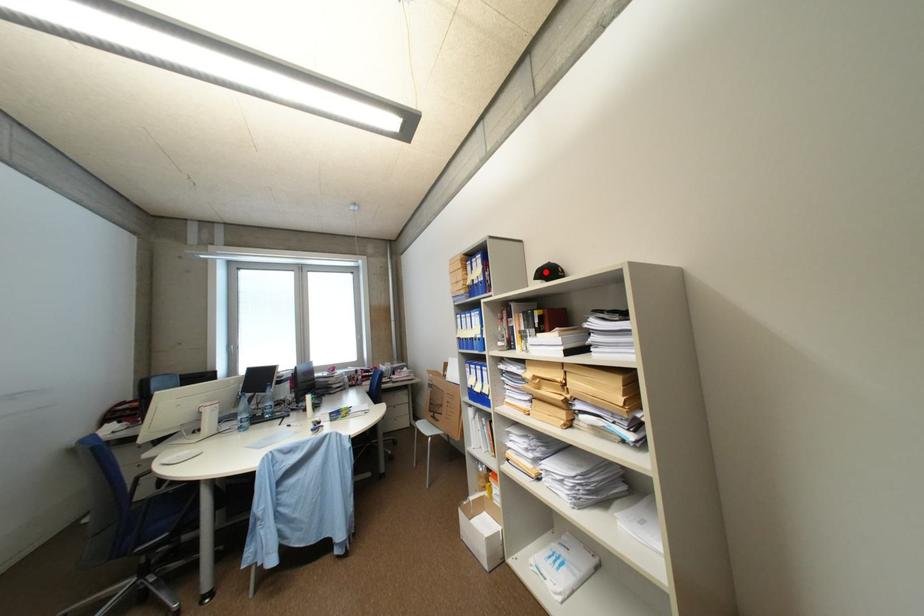
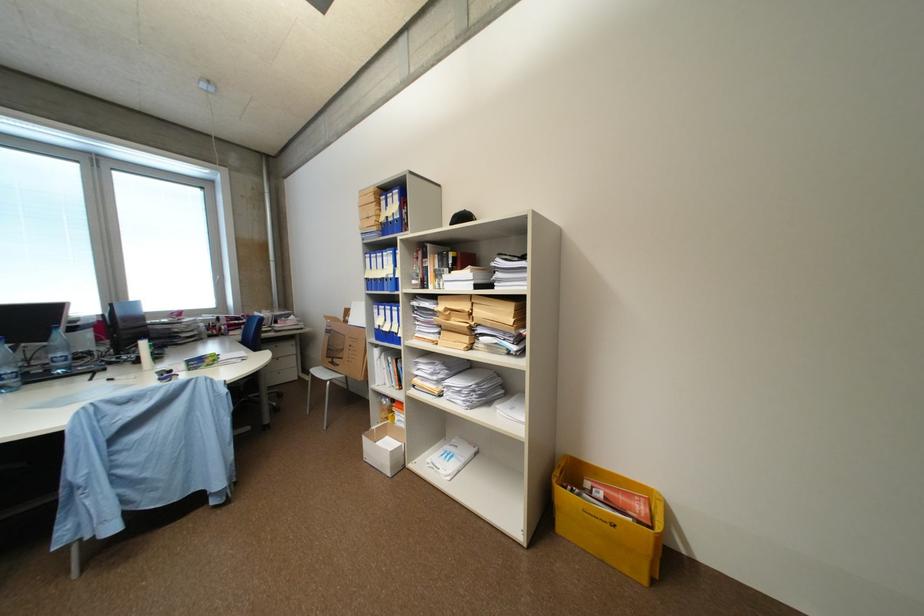
Question: I am providing you with two images of the same scene from different viewpoints. In image1, a red point is highlighted. Considering the same 3D point in image2, which of the following is correct?

Choices:
 (A) It is closer
 (B) It is farther

Answer: (A)